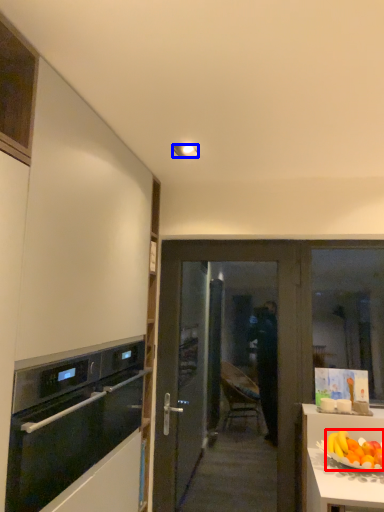
Question: Which object appears farthest to the camera in this image, grapefruit (highlighted by a red box) or lamp (highlighted by a blue box)?

Choices:
 (A) grapefruit
 (B) lamp

Answer: (B)